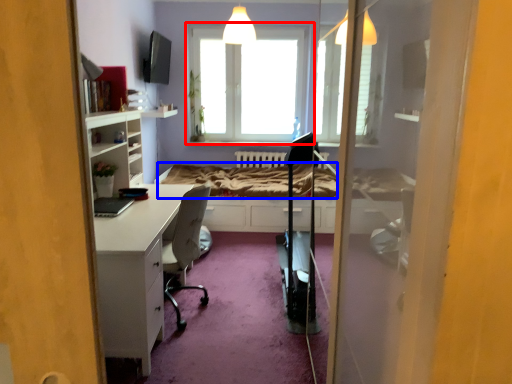
Question: Which of the following is the farthest to the observer, window (highlighted by a red box) or bed frame (highlighted by a blue box)?

Choices:
 (A) window
 (B) bed frame

Answer: (A)